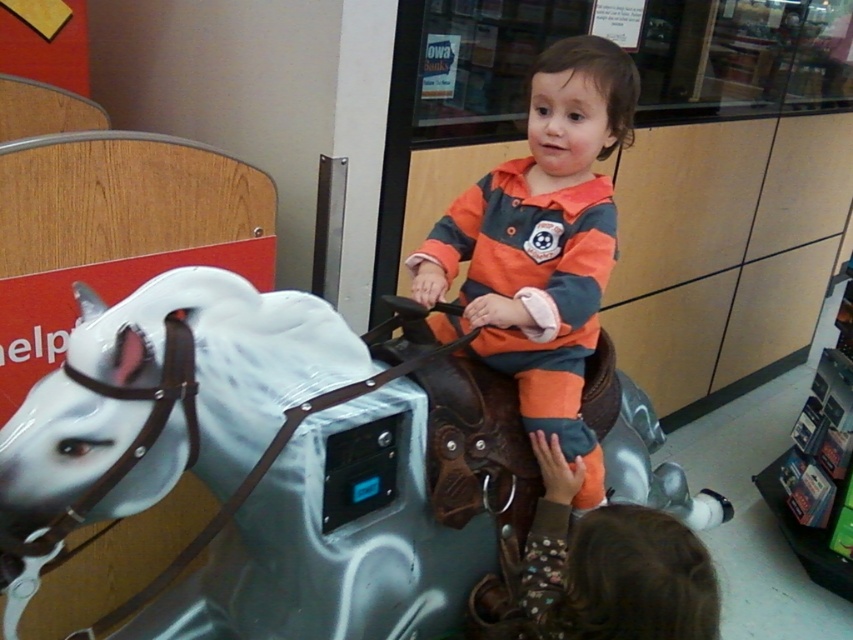
Question: Is white glossy horse at center wider than orange striped sweater at center?

Choices:
 (A) yes
 (B) no

Answer: (A)

Question: Can you confirm if white glossy horse at center is positioned to the left of orange striped sweater at center?

Choices:
 (A) yes
 (B) no

Answer: (B)

Question: Is white glossy horse at center positioned in front of orange striped sweater at center?

Choices:
 (A) no
 (B) yes

Answer: (B)